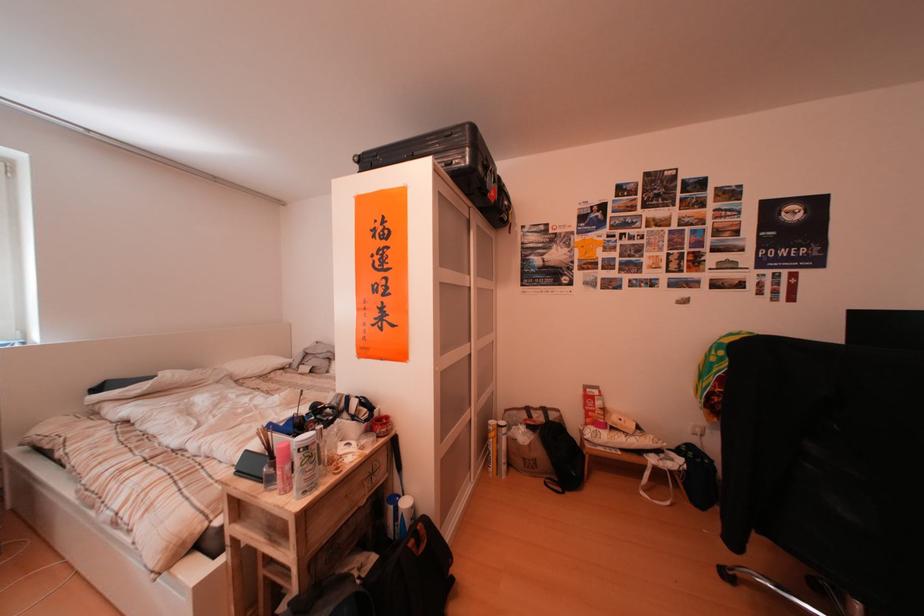
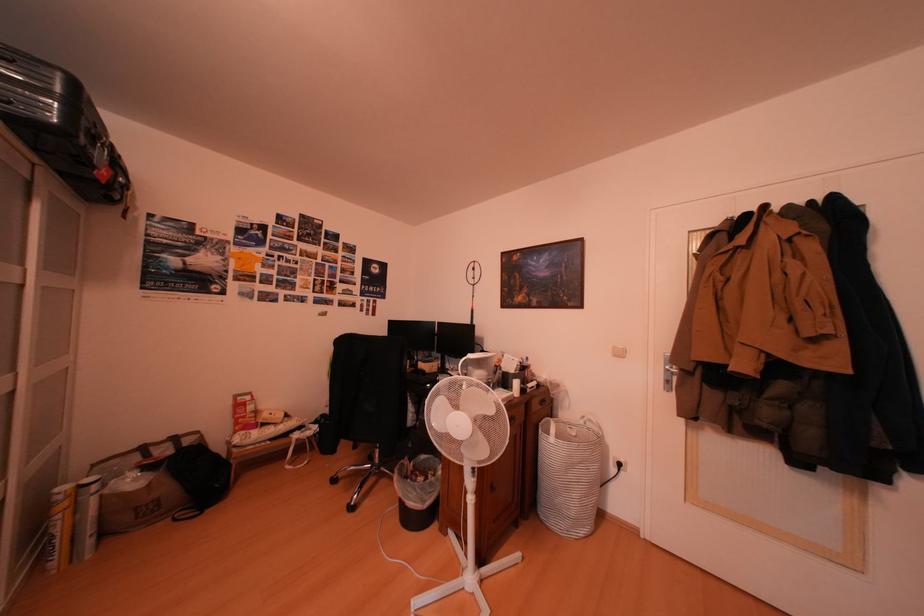
Question: The camera is either moving clockwise (left) or counter-clockwise (right) around the object. The first image is from the beginning of the video and the second image is from the end. Is the camera moving left or right when shooting the video?

Choices:
 (A) Left
 (B) Right

Answer: (A)